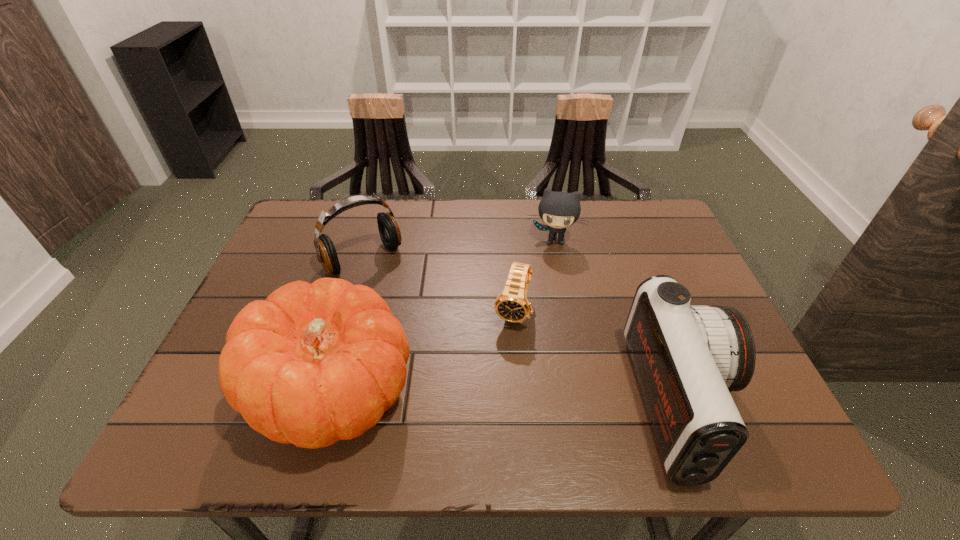
In the image, there is a desktop. Identify the location of blank space at the left edge. This screenshot has width=960, height=540. (278, 279).

Image resolution: width=960 pixels, height=540 pixels. In the image, there is a desktop. In order to click on free space at the right edge in this screenshot , I will do `click(658, 256)`.

Image resolution: width=960 pixels, height=540 pixels. Identify the location of vacant space at the far left corner of the desktop. (284, 234).

Identify the location of vacant space at the far right corner of the desktop. (644, 221).

Identify the location of vacant area that lies between the third object from right to left and the pumpkin. The width and height of the screenshot is (960, 540). [423, 352].

This screenshot has height=540, width=960. In order to click on vacant point located between the fourth object from left to right and the pumpkin in this screenshot , I will do `click(444, 316)`.

In order to click on empty space between the shortest object and the rightmost object in this screenshot , I will do `click(597, 358)`.

Find the location of `free space between the headset and the fourth tallest object`. free space between the headset and the fourth tallest object is located at coordinates (459, 250).

The width and height of the screenshot is (960, 540). In order to click on free point between the watch and the headset in this screenshot , I will do `click(438, 285)`.

The width and height of the screenshot is (960, 540). I want to click on vacant space that is in between the headset and the watch, so click(438, 285).